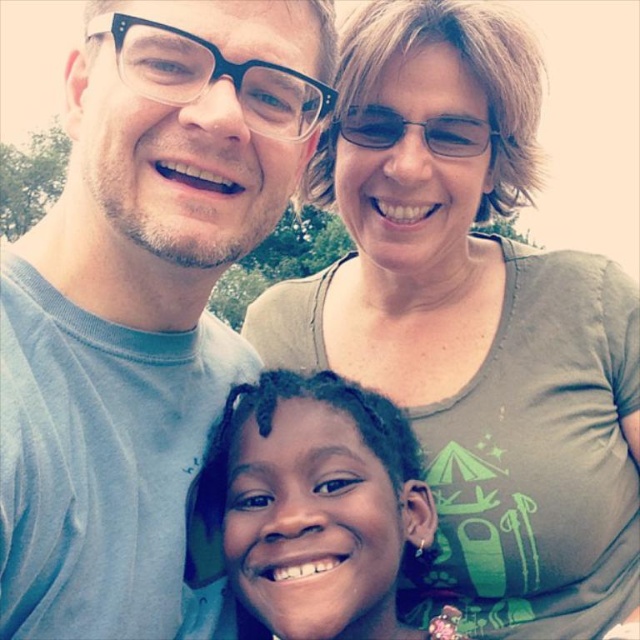
Is point (488, 211) behind point (316, 3)?

That is True.

Who is positioned more to the left, green matte shirt at upper center or clear plastic glasses at upper left?

From the viewer's perspective, clear plastic glasses at upper left appears more on the left side.

I want to click on green matte shirt at upper center, so click(476, 332).

Find the location of `green matte shirt at upper center`. green matte shirt at upper center is located at coordinates (476, 332).

Looking at this image, does dark skin hair at center have a greater height compared to clear plastic glasses at upper center?

Correct, dark skin hair at center is much taller as clear plastic glasses at upper center.

Is point (288, 604) closer to viewer compared to point (465, 132)?

Yes, it is.

Where is `dark skin hair at center`? This screenshot has width=640, height=640. dark skin hair at center is located at coordinates (317, 506).

Can you confirm if clear plastic glasses at upper left is bigger than clear plastic glasses at upper center?

Indeed, clear plastic glasses at upper left has a larger size compared to clear plastic glasses at upper center.

Which is in front, point (145, 45) or point (436, 134)?

Point (145, 45) is in front.

Is point (289, 108) in front of point (442, 150)?

Yes, point (289, 108) is closer to viewer.

The width and height of the screenshot is (640, 640). In order to click on clear plastic glasses at upper left in this screenshot , I will do `click(212, 76)`.